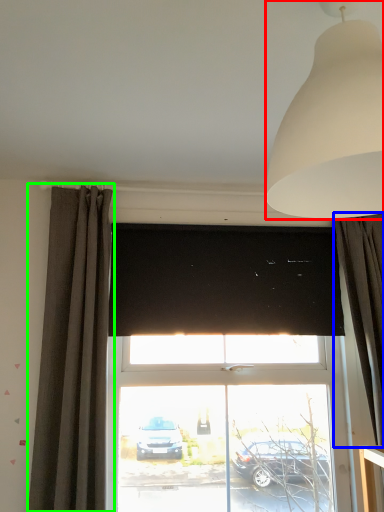
Question: Based on their relative distances, which object is farther from lamp (highlighted by a red box)? Choose from curtain (highlighted by a blue box) and curtain (highlighted by a green box).

Choices:
 (A) curtain
 (B) curtain

Answer: (B)